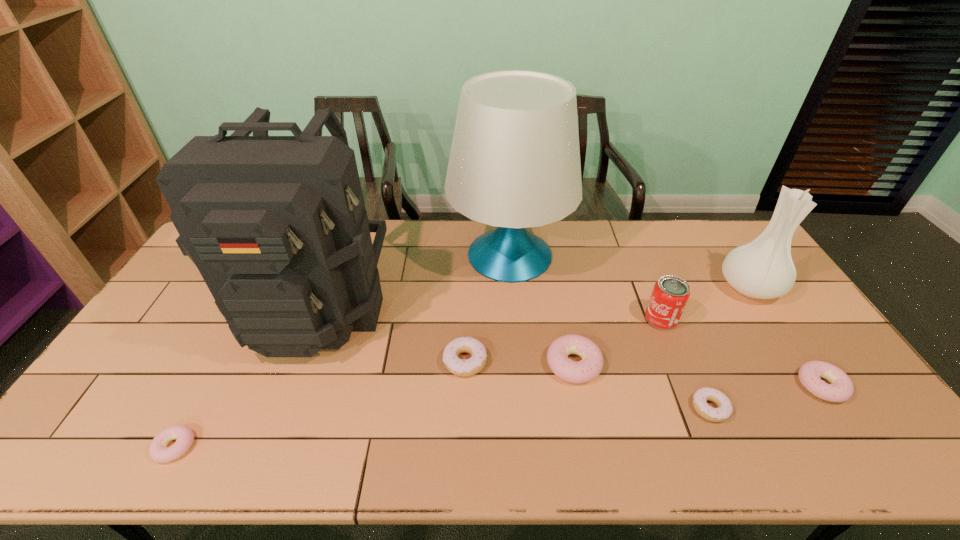
This screenshot has width=960, height=540. In order to click on free spot between the smaller white doughnut and the nearest object in this screenshot , I will do click(x=443, y=427).

This screenshot has height=540, width=960. Find the location of `vacant area between the table lamp and the backpack`. vacant area between the table lamp and the backpack is located at coordinates (413, 280).

The height and width of the screenshot is (540, 960). I want to click on empty space that is in between the nearer white doughnut and the left white doughnut, so click(588, 384).

Find the location of `unoccupied area between the nearest doughnut and the farther white doughnut`. unoccupied area between the nearest doughnut and the farther white doughnut is located at coordinates (320, 403).

Find the location of `unoccupied area between the leftmost pink doughnut and the rightmost pink doughnut`. unoccupied area between the leftmost pink doughnut and the rightmost pink doughnut is located at coordinates (498, 416).

The image size is (960, 540). Find the location of `free spot between the red can and the vase`. free spot between the red can and the vase is located at coordinates (706, 303).

At what (x,y) coordinates should I click in order to perform the action: click on free point between the nearest object and the biggest pink doughnut. Please return your answer as a coordinate pair (x, y). The height and width of the screenshot is (540, 960). Looking at the image, I should click on (374, 405).

Point out which object is positioned as the second nearest to the farther white doughnut. Please provide its 2D coordinates. Your answer should be formatted as a tuple, i.e. [(x, y)], where the tuple contains the x and y coordinates of a point satisfying the conditions above.

[(276, 225)]

Identify which object is the seventh closest to the farther white doughnut. Please provide its 2D coordinates. Your answer should be formatted as a tuple, i.e. [(x, y)], where the tuple contains the x and y coordinates of a point satisfying the conditions above.

[(763, 269)]

This screenshot has height=540, width=960. What are the coordinates of `the second closest doughnut to the farther white doughnut` in the screenshot? It's located at pos(725,408).